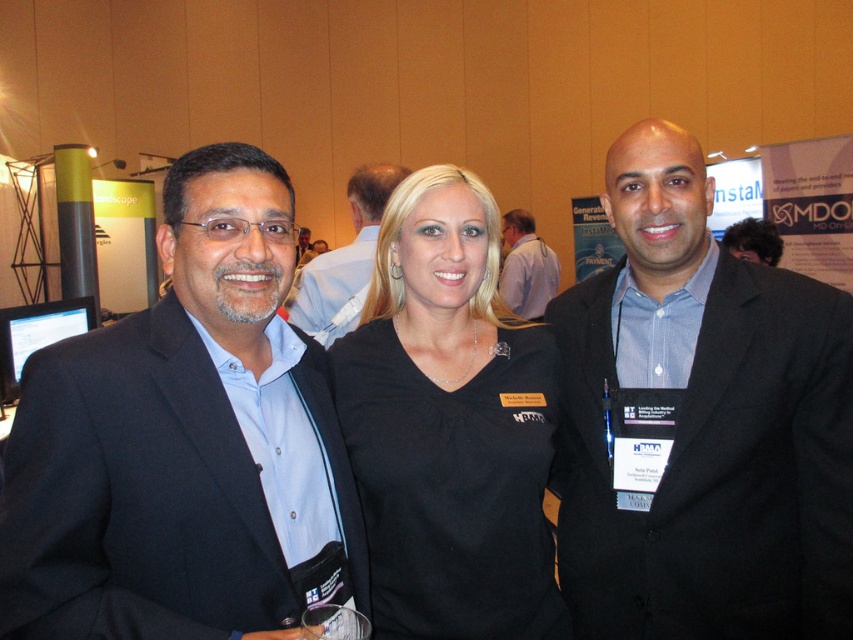
Question: Which point is closer to the camera taking this photo?

Choices:
 (A) pos(376,461)
 (B) pos(181,344)

Answer: (B)

Question: Which object appears closest to the camera in this image?

Choices:
 (A) dark curly hair at center
 (B) black suit at center
 (C) light blue shirt at center
 (D) black matte shirt at center

Answer: (D)

Question: Which of the following is the farthest from the observer?

Choices:
 (A) (492, 276)
 (B) (747, 289)

Answer: (A)

Question: Can you confirm if light blue shirt at center is smaller than dark curly hair at center?

Choices:
 (A) no
 (B) yes

Answer: (A)

Question: Considering the relative positions of blue fabric suit at left and light blue shirt at center in the image provided, where is blue fabric suit at left located with respect to light blue shirt at center?

Choices:
 (A) left
 (B) right

Answer: (A)

Question: Does black suit at center have a greater width compared to light blue shirt at center?

Choices:
 (A) yes
 (B) no

Answer: (A)